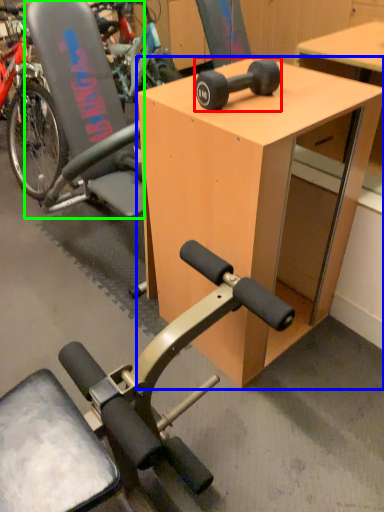
Question: Which is farther away from wheel (highlighted by a red box)? desk (highlighted by a blue box) or swivel chair (highlighted by a green box)?

Choices:
 (A) desk
 (B) swivel chair

Answer: (B)